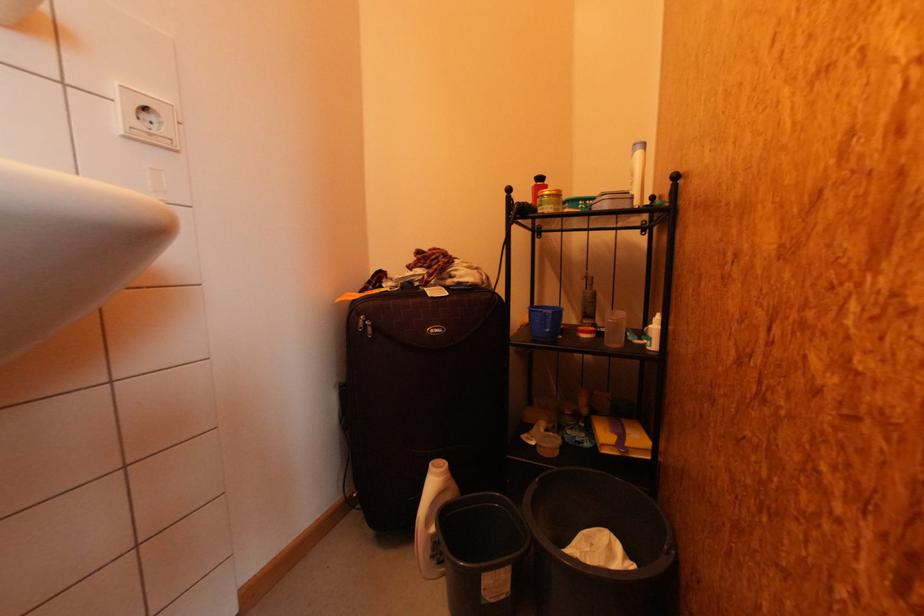
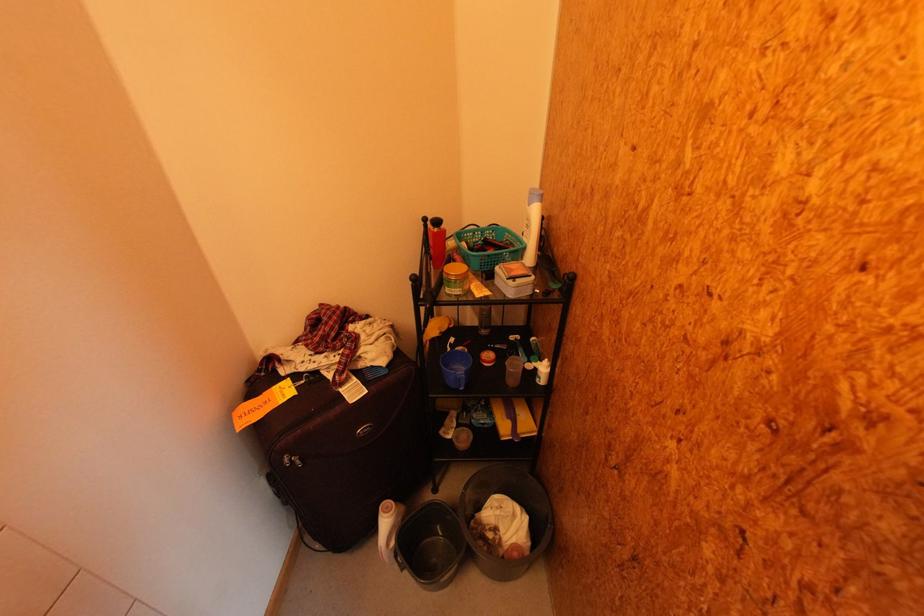
In the second image, find the point that corresponds to [438,530] in the first image.

(397, 545)